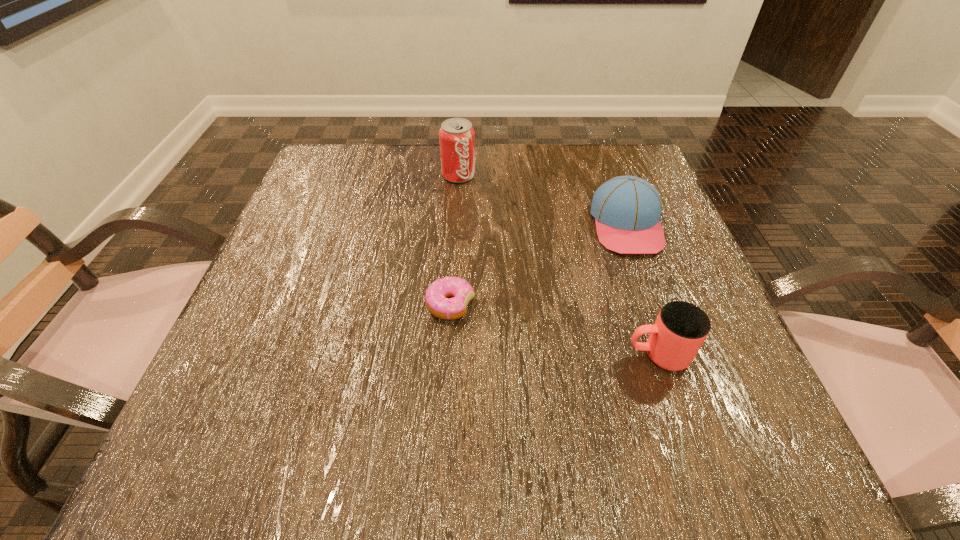
Where is `vacant space situated 0.140m on the handle side of the cup`? vacant space situated 0.140m on the handle side of the cup is located at coordinates (536, 354).

Locate an element on the screen. The height and width of the screenshot is (540, 960). vacant space located 0.350m on the back of the doughnut is located at coordinates (458, 176).

Find the location of a particular element. This screenshot has height=540, width=960. soda can located in the far edge section of the desktop is located at coordinates (457, 137).

The height and width of the screenshot is (540, 960). What are the coordinates of `baseball cap that is positioned at the far edge` in the screenshot? It's located at (627, 209).

Image resolution: width=960 pixels, height=540 pixels. Find the location of `baseball cap located at the right edge`. baseball cap located at the right edge is located at coordinates (627, 209).

Locate an element on the screen. The width and height of the screenshot is (960, 540). cup present at the right edge is located at coordinates (681, 328).

This screenshot has height=540, width=960. What are the coordinates of `object located in the far right corner section of the desktop` in the screenshot? It's located at (627, 209).

Identify the location of vacant space at the far edge of the desktop. The image size is (960, 540). (x=537, y=174).

Locate an element on the screen. The image size is (960, 540). vacant space at the near edge of the desktop is located at coordinates (514, 460).

The height and width of the screenshot is (540, 960). What are the coordinates of `free region at the left edge of the desktop` in the screenshot? It's located at (274, 275).